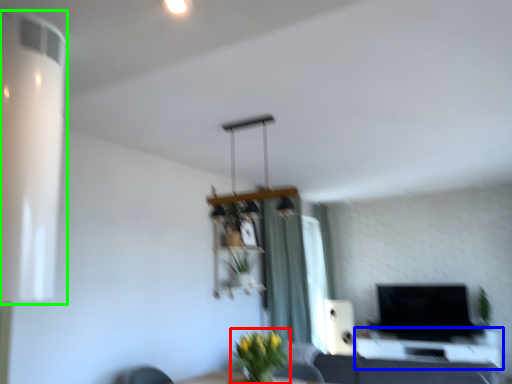
Question: Which object is positioned closest to plant (highlighted by a red box)? Select from table (highlighted by a blue box) and air conditioning (highlighted by a green box).

Choices:
 (A) table
 (B) air conditioning

Answer: (B)